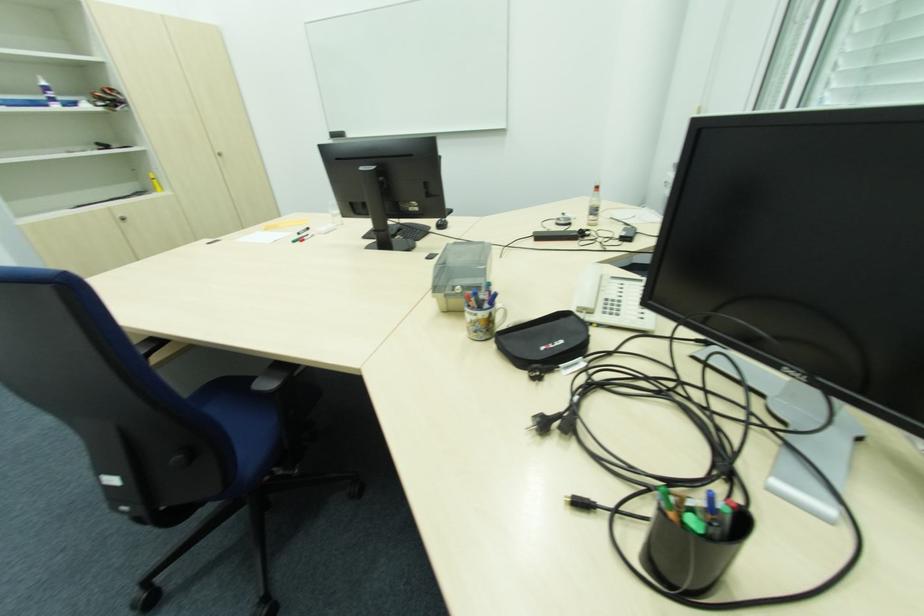
What do you see at coordinates (224, 400) in the screenshot?
I see `a blue chair sitting surface` at bounding box center [224, 400].